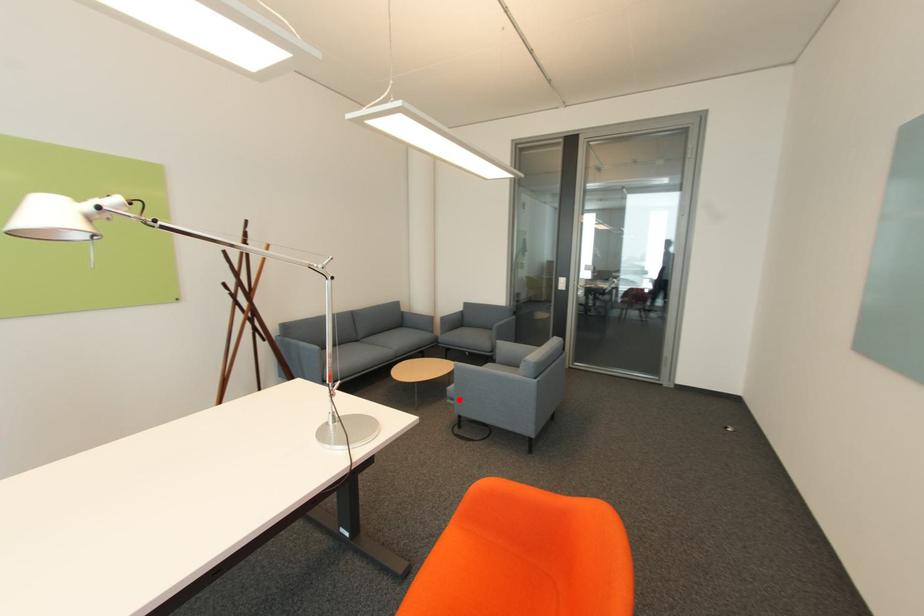
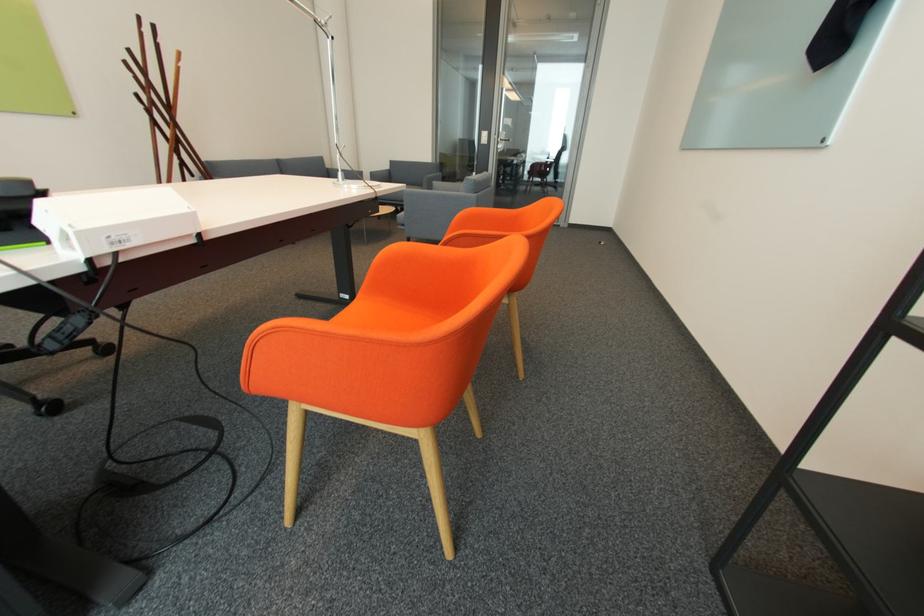
Locate, in the second image, the point that corresponds to the highlighted location in the first image.

(408, 225)